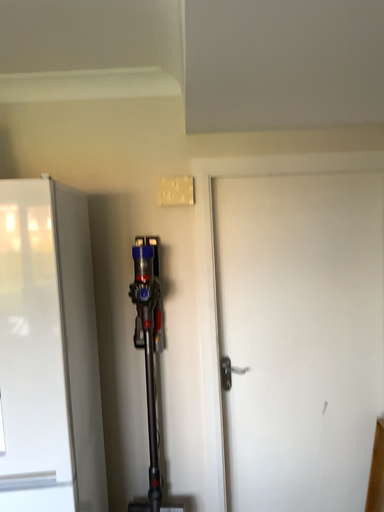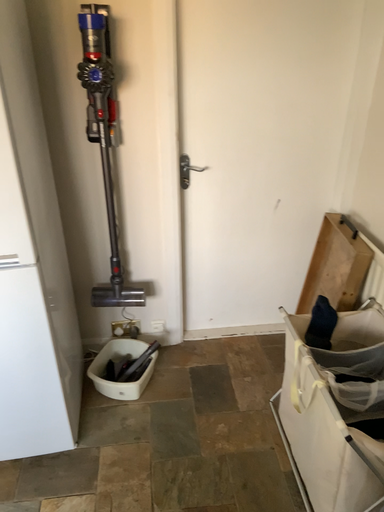
Question: Which way did the camera rotate in the video?

Choices:
 (A) rotated upward
 (B) rotated downward

Answer: (B)